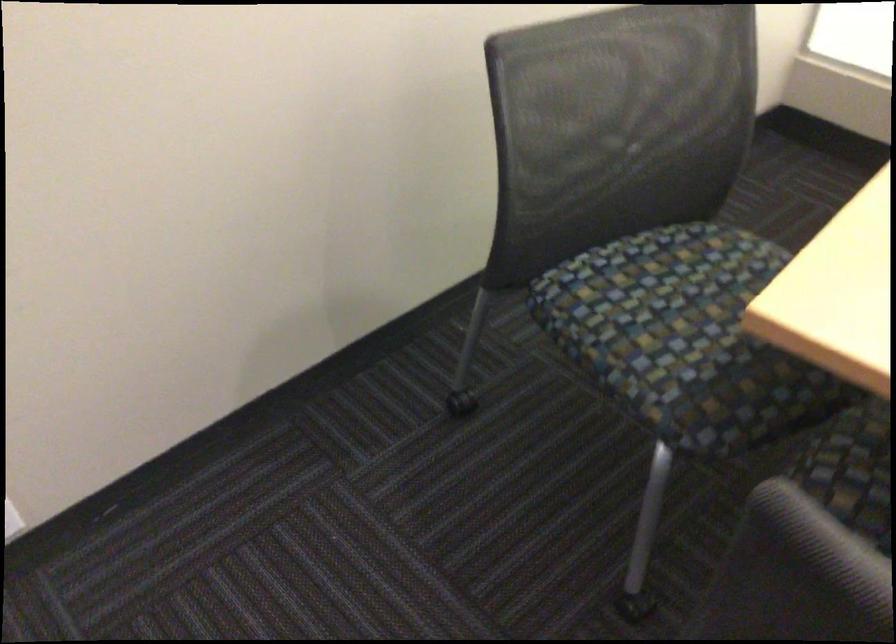
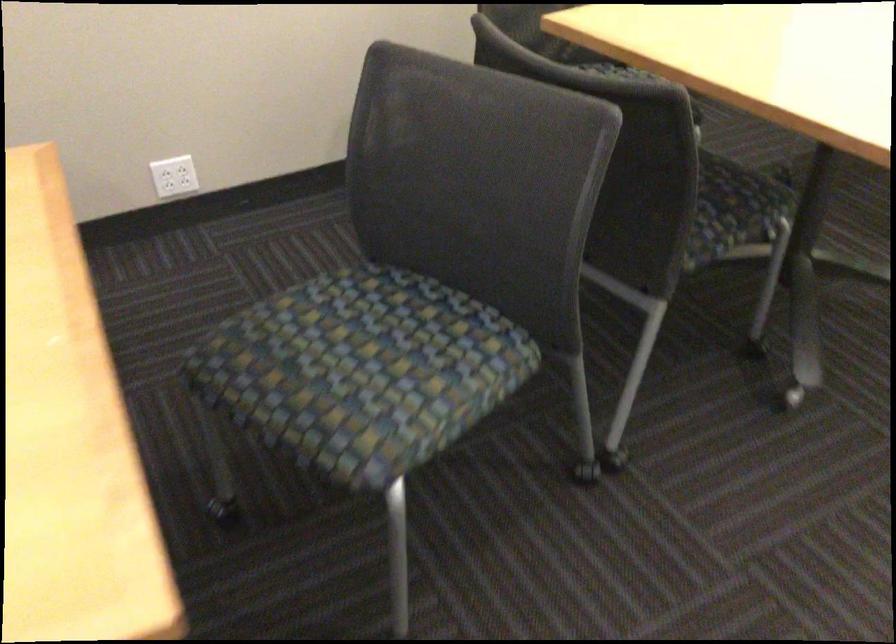
Looking at this image, the images are taken continuously from a first-person perspective. In which direction are you moving?

The movement direction of the cameraman is right, backward.